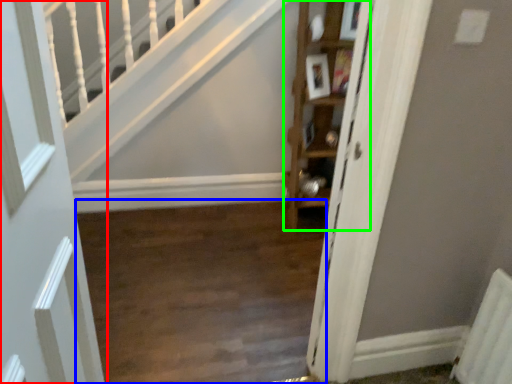
Question: Which object is positioned farthest from door (highlighted by a red box)? Select from corridor (highlighted by a blue box) and cabinet (highlighted by a green box).

Choices:
 (A) corridor
 (B) cabinet

Answer: (B)